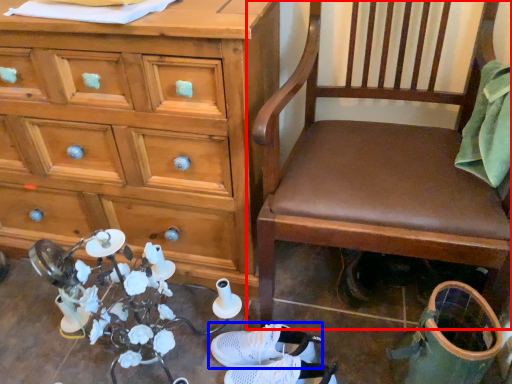
Question: Which object is further to the camera taking this photo, chair (highlighted by a red box) or footwear (highlighted by a blue box)?

Choices:
 (A) chair
 (B) footwear

Answer: (B)